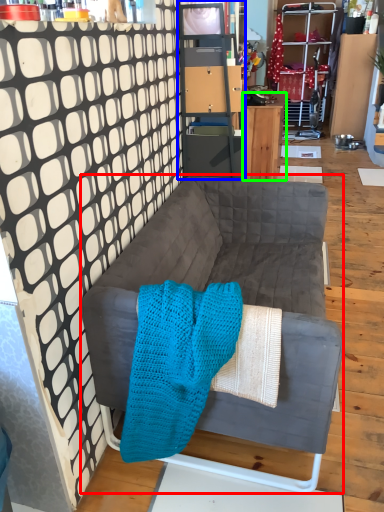
Question: Which object is positioned farthest from studio couch (highlighted by a red box)? Select from cabinetry (highlighted by a blue box) and desk (highlighted by a green box).

Choices:
 (A) cabinetry
 (B) desk

Answer: (B)